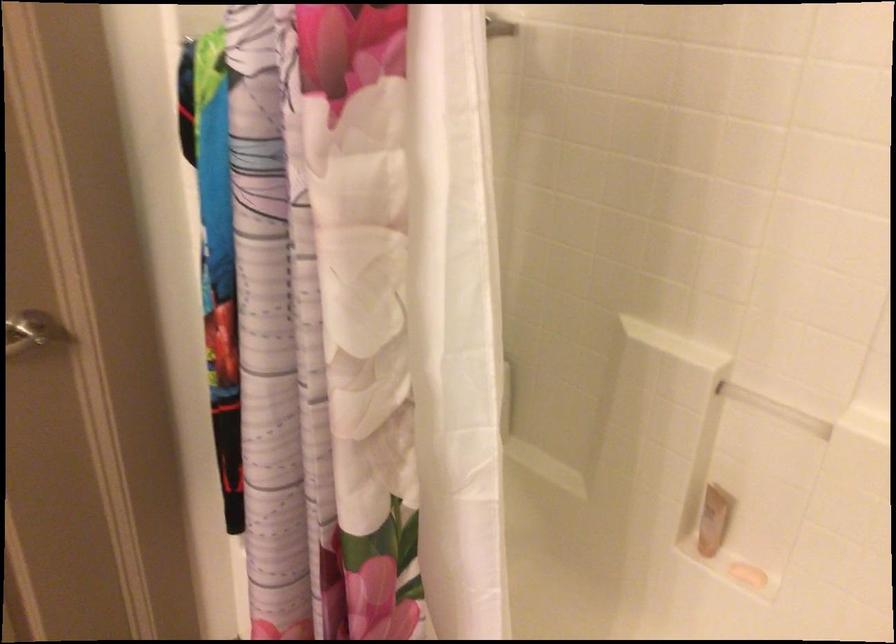
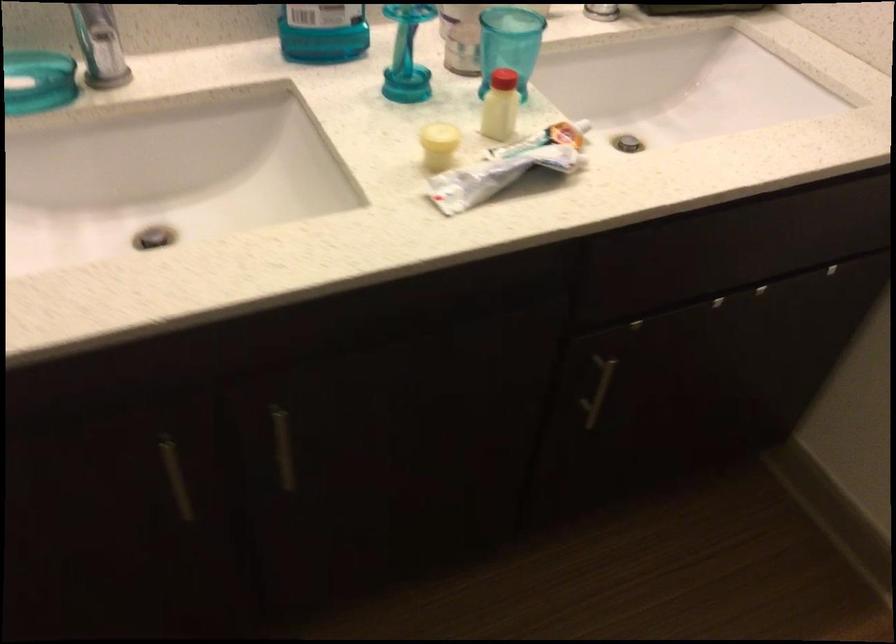
The first image is from the beginning of the video and the second image is from the end. How did the camera likely rotate when shooting the video?

The rotation direction of the camera is left-down.